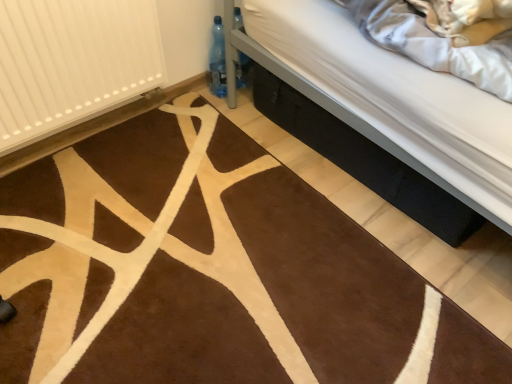
Question: From the image's perspective, is black fabric bed at lower right above or below white ribbed radiator at left?

Choices:
 (A) below
 (B) above

Answer: (A)

Question: Considering their positions, is black fabric bed at lower right located in front of or behind white ribbed radiator at left?

Choices:
 (A) behind
 (B) front

Answer: (A)

Question: Looking at the image, does black fabric bed at lower right seem bigger or smaller compared to white ribbed radiator at left?

Choices:
 (A) big
 (B) small

Answer: (A)

Question: From a real-world perspective, is white ribbed radiator at left positioned above or below black fabric bed at lower right?

Choices:
 (A) above
 (B) below

Answer: (A)

Question: Is white ribbed radiator at left inside the boundaries of black fabric bed at lower right, or outside?

Choices:
 (A) inside
 (B) outside

Answer: (B)

Question: Considering the relative positions of white ribbed radiator at left and black fabric bed at lower right in the image provided, is white ribbed radiator at left to the left or to the right of black fabric bed at lower right?

Choices:
 (A) left
 (B) right

Answer: (A)

Question: In terms of width, does white ribbed radiator at left look wider or thinner when compared to black fabric bed at lower right?

Choices:
 (A) thin
 (B) wide

Answer: (A)